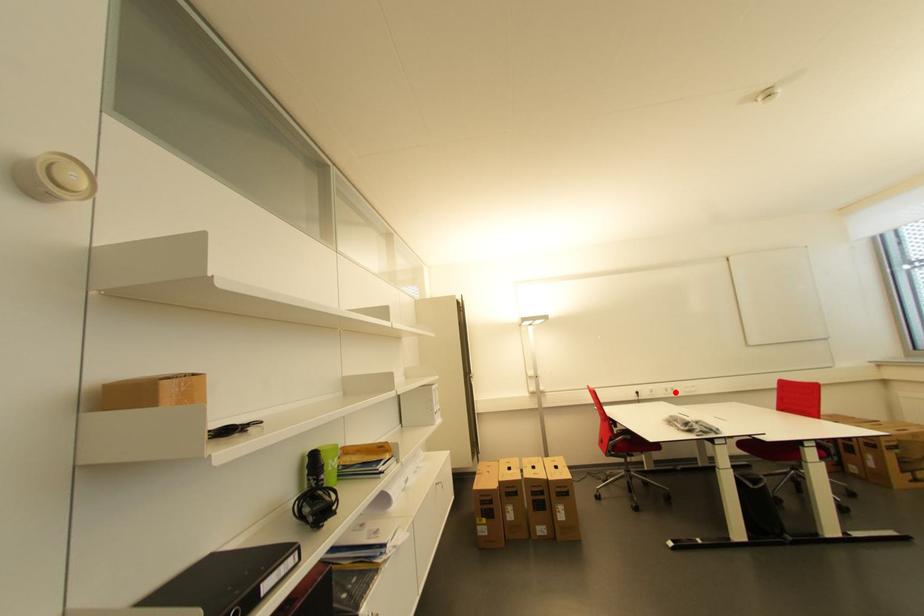
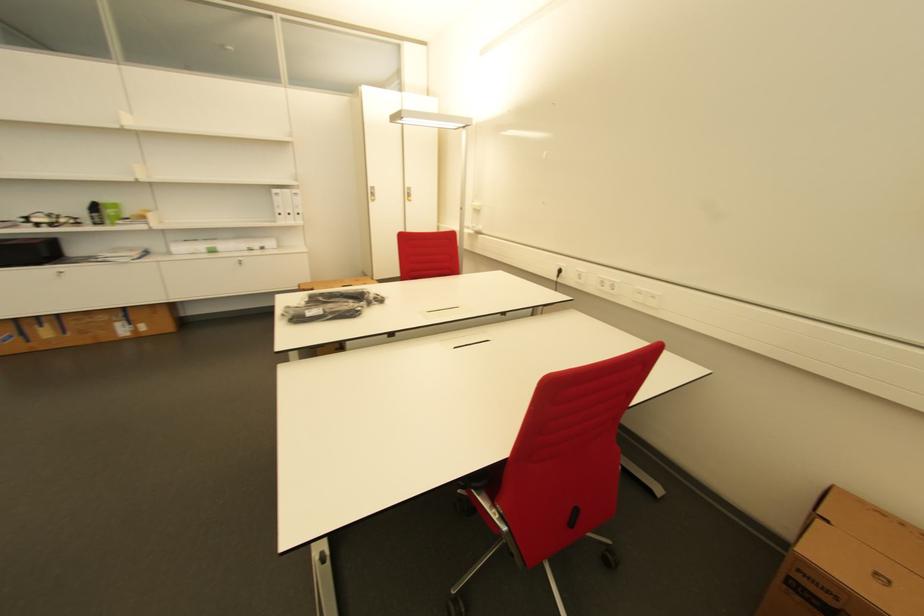
Find the pixel in the second image that matches the highlighted location in the first image.

(612, 289)